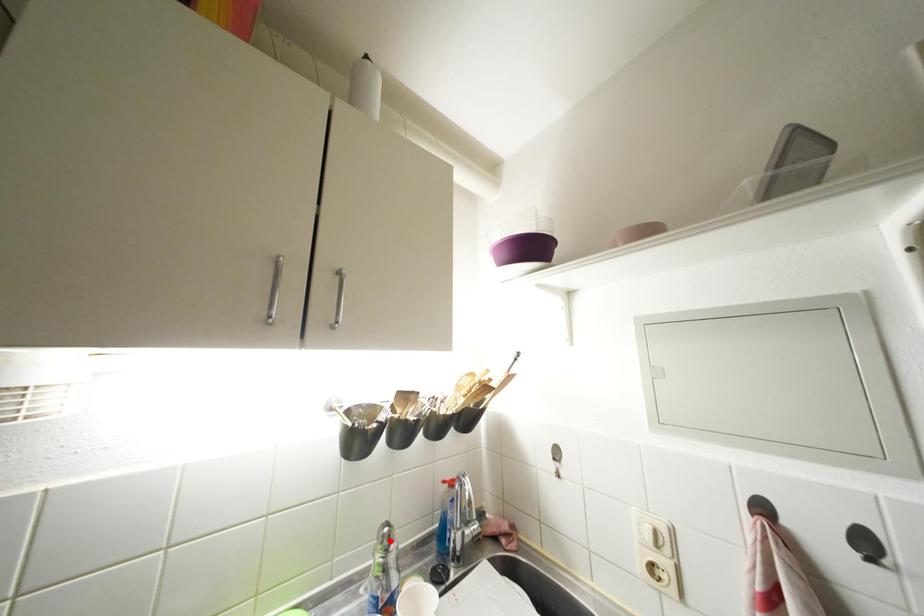
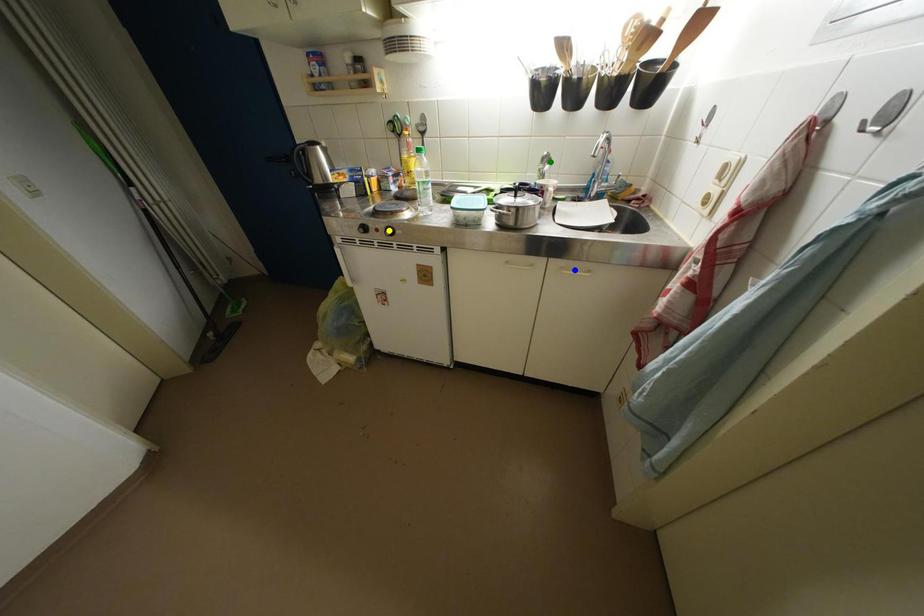
Question: I am providing you with two images of the same scene from different viewpoints. A red point is marked on the first image. You are given multiple points on the second image. Which spot in image 2 lines up with the point in image 1?

Choices:
 (A) yellow point
 (B) green point
 (C) blue point

Answer: (B)